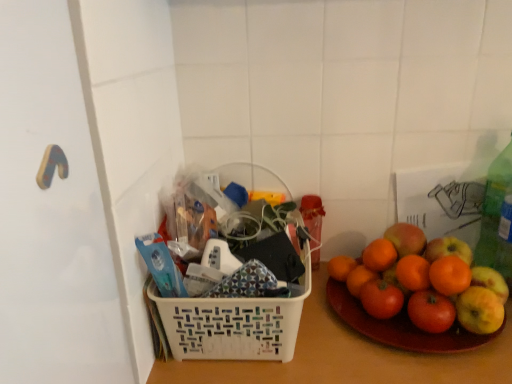
Question: Should I look upward or downward to see white plastic basket at center?

Choices:
 (A) up
 (B) down

Answer: (B)

Question: Can you confirm if white plastic basket at center is shorter than white plastic basket at center?

Choices:
 (A) no
 (B) yes

Answer: (B)

Question: Does white plastic basket at center have a greater width compared to white plastic basket at center?

Choices:
 (A) yes
 (B) no

Answer: (B)

Question: From a real-world perspective, does white plastic basket at center stand above white plastic basket at center?

Choices:
 (A) no
 (B) yes

Answer: (B)

Question: From the image's perspective, is white plastic basket at center below white plastic basket at center?

Choices:
 (A) no
 (B) yes

Answer: (A)

Question: Is white plastic basket at center smaller than white plastic basket at center?

Choices:
 (A) yes
 (B) no

Answer: (A)

Question: Can you confirm if white plastic basket at center is bigger than white plastic basket at center?

Choices:
 (A) no
 (B) yes

Answer: (A)

Question: Is white plastic basket at center located outside smooth orange grapefruit at right?

Choices:
 (A) no
 (B) yes

Answer: (B)

Question: Does white plastic basket at center turn towards smooth orange grapefruit at right?

Choices:
 (A) no
 (B) yes

Answer: (A)

Question: Is white plastic basket at center not close to smooth orange grapefruit at right?

Choices:
 (A) no
 (B) yes

Answer: (A)

Question: Considering the relative positions of white plastic basket at center and smooth orange grapefruit at right in the image provided, is white plastic basket at center in front of smooth orange grapefruit at right?

Choices:
 (A) no
 (B) yes

Answer: (B)

Question: From the image's perspective, is white plastic basket at center above smooth orange grapefruit at right?

Choices:
 (A) no
 (B) yes

Answer: (A)

Question: Can you confirm if white plastic basket at center is taller than smooth orange grapefruit at right?

Choices:
 (A) no
 (B) yes

Answer: (B)

Question: Is green plastic bottle at right at the right side of white plastic basket at center?

Choices:
 (A) yes
 (B) no

Answer: (A)